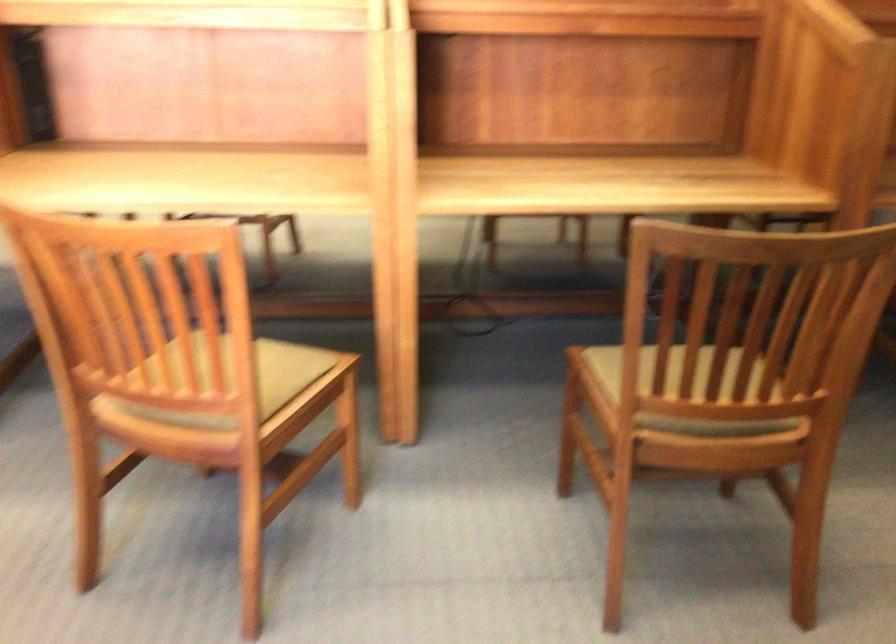
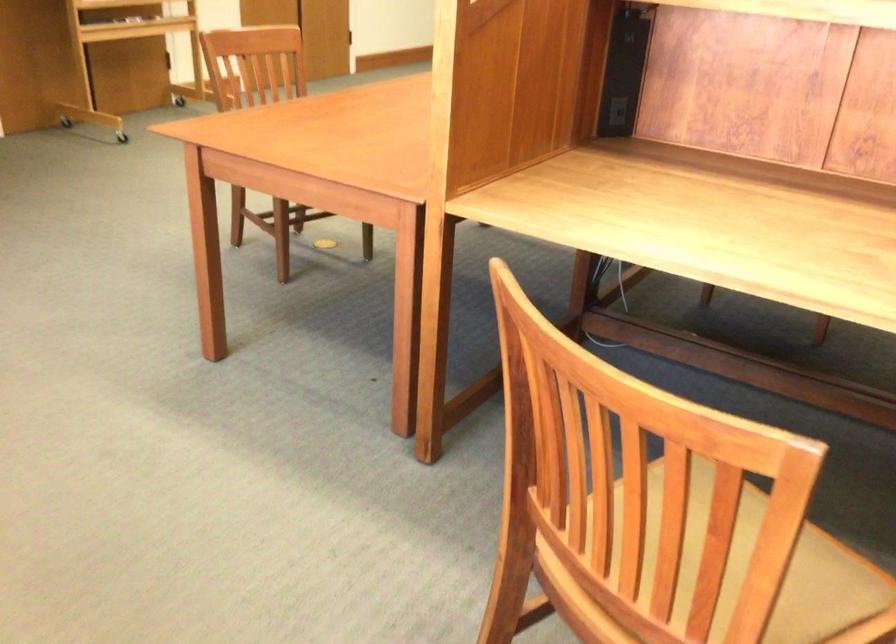
In the second image, find the point that corresponds to [294,375] in the first image.

(833, 594)